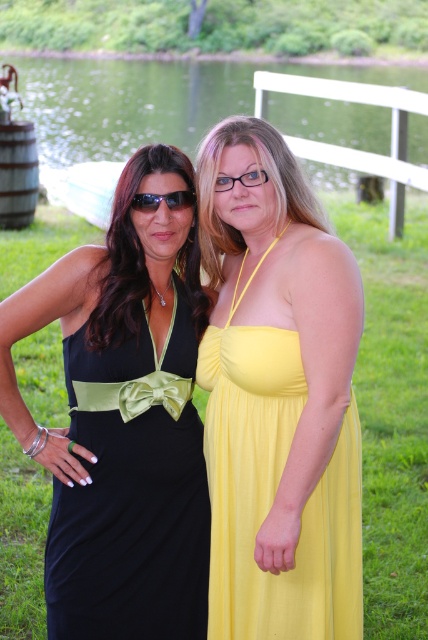
Does black satin dress at left have a lesser height compared to green grass at lower center?

Correct, black satin dress at left is not as tall as green grass at lower center.

Which of these two, black satin dress at left or green grass at lower center, stands taller?

green grass at lower center

Does point (113, 632) come behind point (183, 64)?

No, (113, 632) is closer to viewer.

The height and width of the screenshot is (640, 428). I want to click on black satin dress at left, so click(131, 493).

Which is more to the left, green grass at lower center or sunglasses at center?

From the viewer's perspective, sunglasses at center appears more on the left side.

Is point (186, 125) positioned in front of point (130, 202)?

No, it is not.

At what (x,y) coordinates should I click in order to perform the action: click on green grass at lower center. Please return your answer as a coordinate pair (x, y). Looking at the image, I should click on (148, 100).

Does point (232, 224) lie behind point (98, 141)?

No.

Who is lower down, yellow satin dress at center or green grass at lower center?

yellow satin dress at center

What do you see at coordinates (278, 397) in the screenshot? The image size is (428, 640). I see `yellow satin dress at center` at bounding box center [278, 397].

You are a GUI agent. You are given a task and a screenshot of the screen. Output one action in this format:
    pyautogui.click(x=<x>, y=<y>)
    Task: Click on the yellow satin dress at center
    
    Given the screenshot: What is the action you would take?
    pyautogui.click(x=278, y=397)